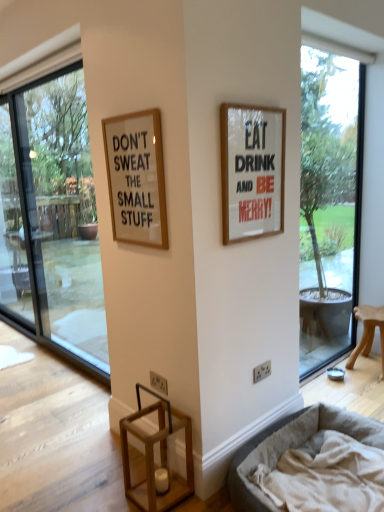
Question: From a real-world perspective, is transparent glass window at left, which is the second window in right-to-left order, positioned over white matte picture frame at upper right, the first picture frame in the right-to-left sequence, based on gravity?

Choices:
 (A) no
 (B) yes

Answer: (A)

Question: Is transparent glass window at left, positioned as the first window in left-to-right order, positioned far away from white matte picture frame at upper right, acting as the second picture frame starting from the left?

Choices:
 (A) yes
 (B) no

Answer: (A)

Question: Is transparent glass window at left, which is the second window in right-to-left order, further to camera compared to white matte picture frame at upper right, acting as the second picture frame starting from the left?

Choices:
 (A) no
 (B) yes

Answer: (B)

Question: Can you confirm if transparent glass window at left, positioned as the first window in left-to-right order, is shorter than white matte picture frame at upper right, the first picture frame in the right-to-left sequence?

Choices:
 (A) yes
 (B) no

Answer: (B)

Question: Can you confirm if transparent glass window at left, positioned as the first window in left-to-right order, is smaller than white matte picture frame at upper right, the first picture frame in the right-to-left sequence?

Choices:
 (A) no
 (B) yes

Answer: (A)

Question: Looking at their shapes, would you say transparent glass window at right, arranged as the second window when viewed from the left, is wider or thinner than transparent glass window at left, positioned as the first window in left-to-right order?

Choices:
 (A) wide
 (B) thin

Answer: (B)

Question: Is point (349, 194) closer or farther from the camera than point (31, 150)?

Choices:
 (A) closer
 (B) farther

Answer: (A)

Question: In terms of size, does transparent glass window at right, which appears as the first window when viewed from the right, appear bigger or smaller than transparent glass window at left, positioned as the first window in left-to-right order?

Choices:
 (A) big
 (B) small

Answer: (B)

Question: From their relative heights in the image, would you say transparent glass window at right, arranged as the second window when viewed from the left, is taller or shorter than transparent glass window at left, positioned as the first window in left-to-right order?

Choices:
 (A) short
 (B) tall

Answer: (B)

Question: Is transparent glass window at right, which appears as the first window when viewed from the right, taller or shorter than wooden stool at right?

Choices:
 (A) tall
 (B) short

Answer: (A)

Question: Considering the positions of point (337, 124) and point (365, 313), is point (337, 124) closer or farther from the camera than point (365, 313)?

Choices:
 (A) farther
 (B) closer

Answer: (A)

Question: From the image's perspective, is transparent glass window at right, which appears as the first window when viewed from the right, positioned above or below wooden stool at right?

Choices:
 (A) below
 (B) above

Answer: (B)

Question: Relative to wooden stool at right, is transparent glass window at right, which appears as the first window when viewed from the right, in front or behind?

Choices:
 (A) front
 (B) behind

Answer: (A)

Question: Considering their positions, is transparent glass window at left, positioned as the first window in left-to-right order, located in front of or behind gray fabric dog bed at lower right?

Choices:
 (A) behind
 (B) front

Answer: (A)

Question: Based on their sizes in the image, would you say transparent glass window at left, which is the second window in right-to-left order, is bigger or smaller than gray fabric dog bed at lower right?

Choices:
 (A) big
 (B) small

Answer: (A)